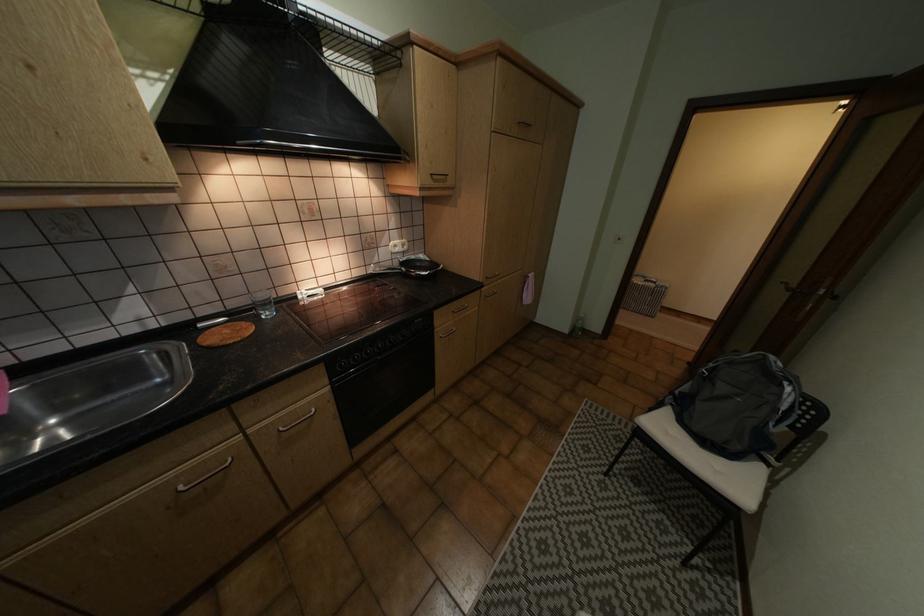
The height and width of the screenshot is (616, 924). In order to click on black pan handle in this screenshot , I will do `click(418, 265)`.